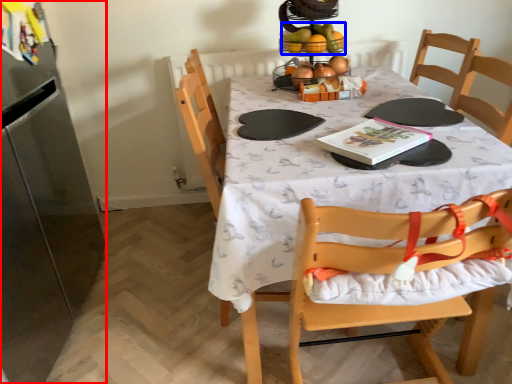
Question: Which of the following is the closest to the observer, appliance (highlighted by a red box) or fruit (highlighted by a blue box)?

Choices:
 (A) appliance
 (B) fruit

Answer: (A)